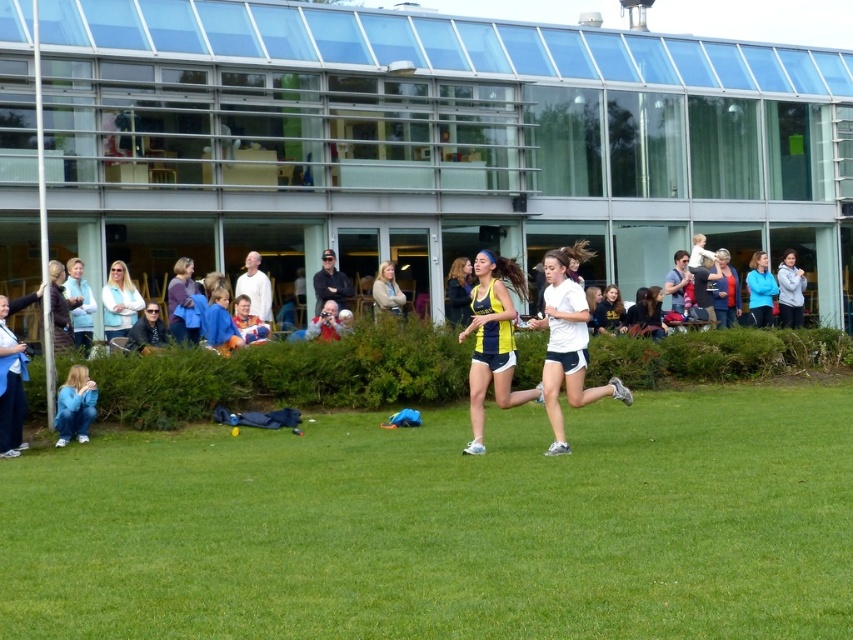
Who is positioned more to the right, yellow and blue athletic uniform at center or yellow jersey at center?

From the viewer's perspective, yellow and blue athletic uniform at center appears more on the right side.

Is point (521, 397) closer to viewer compared to point (456, 269)?

Yes, point (521, 397) is closer to viewer.

Where is `yellow and blue athletic uniform at center`? Image resolution: width=853 pixels, height=640 pixels. yellow and blue athletic uniform at center is located at coordinates (492, 340).

What do you see at coordinates (74, 404) in the screenshot?
I see `blue denim jeans at lower left` at bounding box center [74, 404].

Between blue denim jeans at lower left and yellow jersey at center, which one has less height?

Standing shorter between the two is blue denim jeans at lower left.

Find the location of a particular element. The image size is (853, 640). blue denim jeans at lower left is located at coordinates (74, 404).

Does blue fabric jacket at upper right appear over light brown leather jacket at center?

Incorrect, blue fabric jacket at upper right is not positioned above light brown leather jacket at center.

Which of these two, blue fabric jacket at upper right or light brown leather jacket at center, stands taller?

blue fabric jacket at upper right

What do you see at coordinates (759, 291) in the screenshot?
I see `blue fabric jacket at upper right` at bounding box center [759, 291].

The height and width of the screenshot is (640, 853). I want to click on blue fabric jacket at upper right, so click(x=759, y=291).